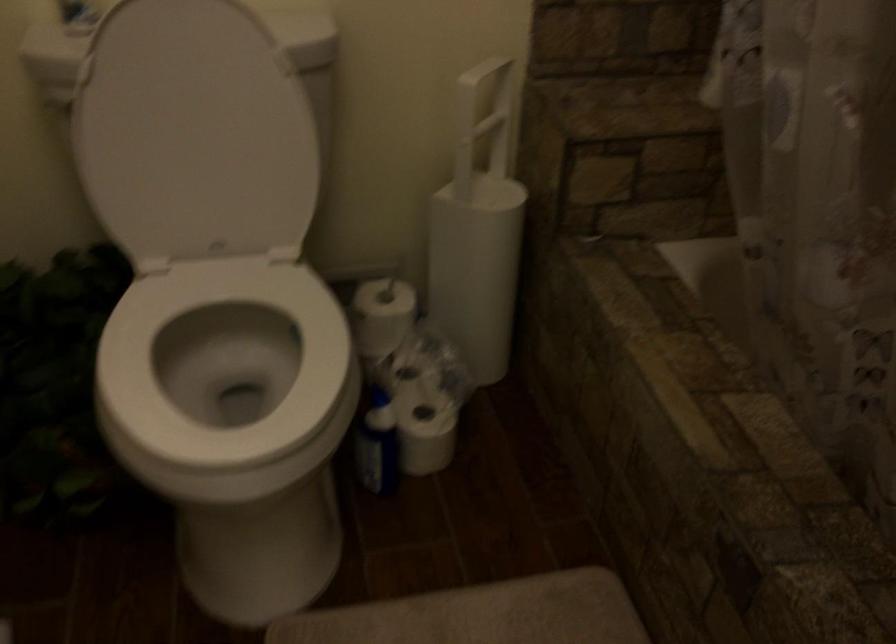
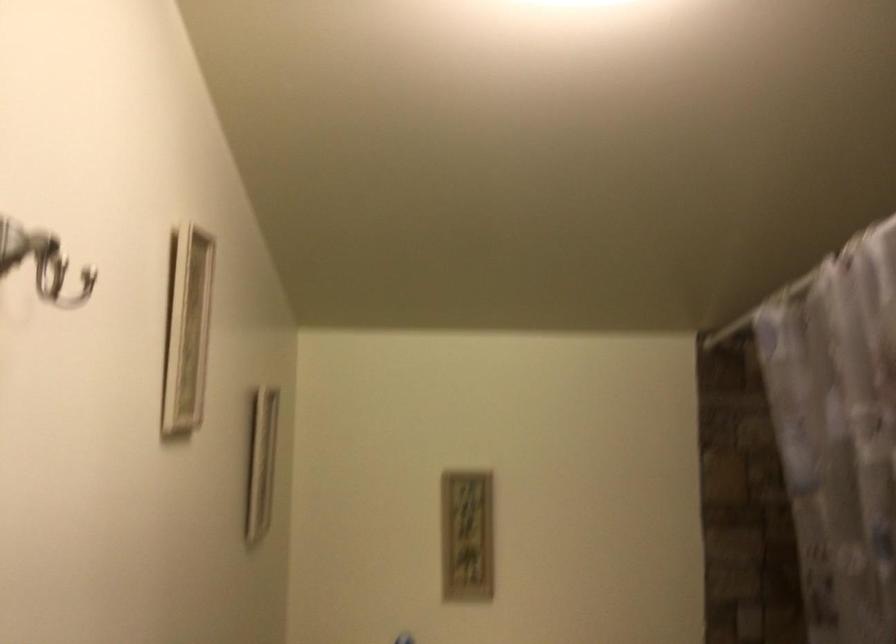
How did the camera likely rotate?

The rotation direction of the camera is left-up.